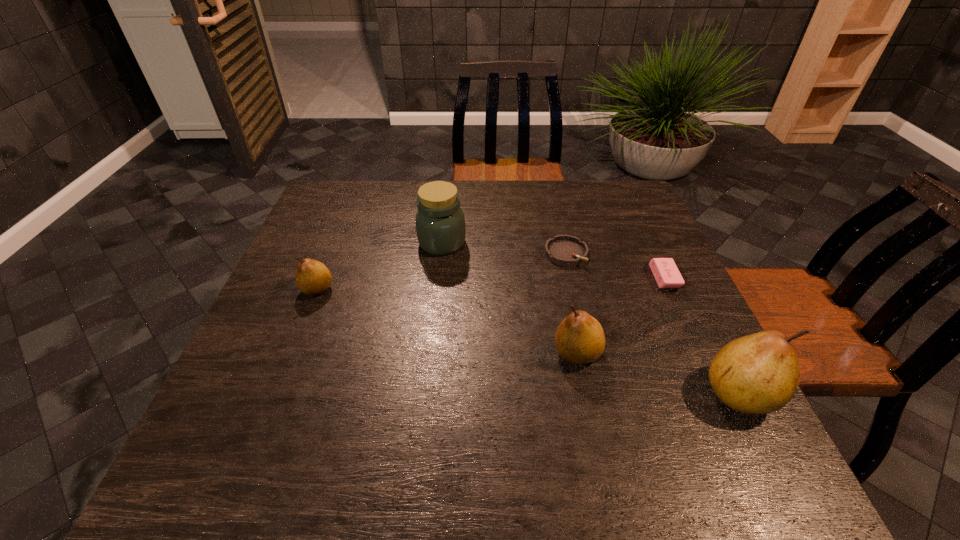
Locate an element on the screen. The height and width of the screenshot is (540, 960). vacant region that satisfies the following two spatial constraints: 1. on the front side of the jar; 2. on the right side of the eraser is located at coordinates point(438,278).

I want to click on vacant space that satisfies the following two spatial constraints: 1. on the front side of the second pear from right to left; 2. on the left side of the rightmost pear, so click(585, 393).

You are a GUI agent. You are given a task and a screenshot of the screen. Output one action in this format:
    pyautogui.click(x=<x>, y=<y>)
    Task: Click on the vacant space that satisfies the following two spatial constraints: 1. on the front side of the ashtray; 2. on the right side of the tallest pear
    The width and height of the screenshot is (960, 540).
    Given the screenshot: What is the action you would take?
    pyautogui.click(x=598, y=393)